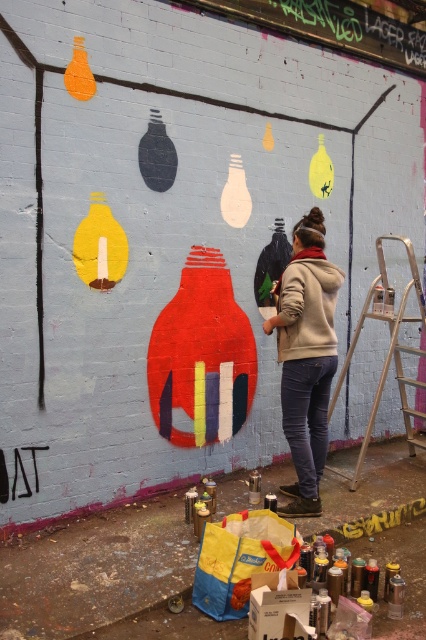
Question: Among these points, which one is nearest to the camera?

Choices:
 (A) [310, 355]
 (B) [394, 296]

Answer: (A)

Question: Can you confirm if beige fleece jacket at center is positioned below metallic silver step ladder at right?

Choices:
 (A) no
 (B) yes

Answer: (B)

Question: Which point is closer to the camera taking this photo?

Choices:
 (A) (313, 252)
 (B) (425, 440)

Answer: (A)

Question: Does beige fleece jacket at center have a larger size compared to metallic silver step ladder at right?

Choices:
 (A) no
 (B) yes

Answer: (A)

Question: Is beige fleece jacket at center above metallic silver step ladder at right?

Choices:
 (A) yes
 (B) no

Answer: (B)

Question: Among these objects, which one is nearest to the camera?

Choices:
 (A) metallic silver step ladder at right
 (B) beige fleece jacket at center

Answer: (B)